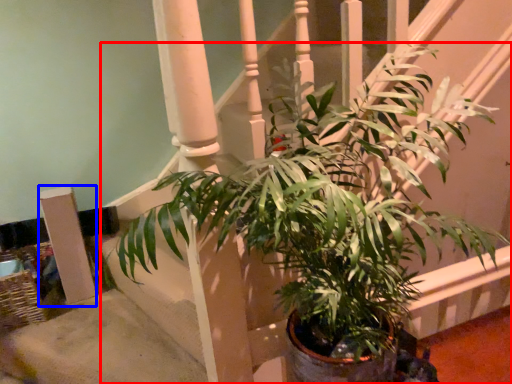
Question: Which object is closer to the camera taking this photo, houseplant (highlighted by a red box) or pillar (highlighted by a blue box)?

Choices:
 (A) houseplant
 (B) pillar

Answer: (A)